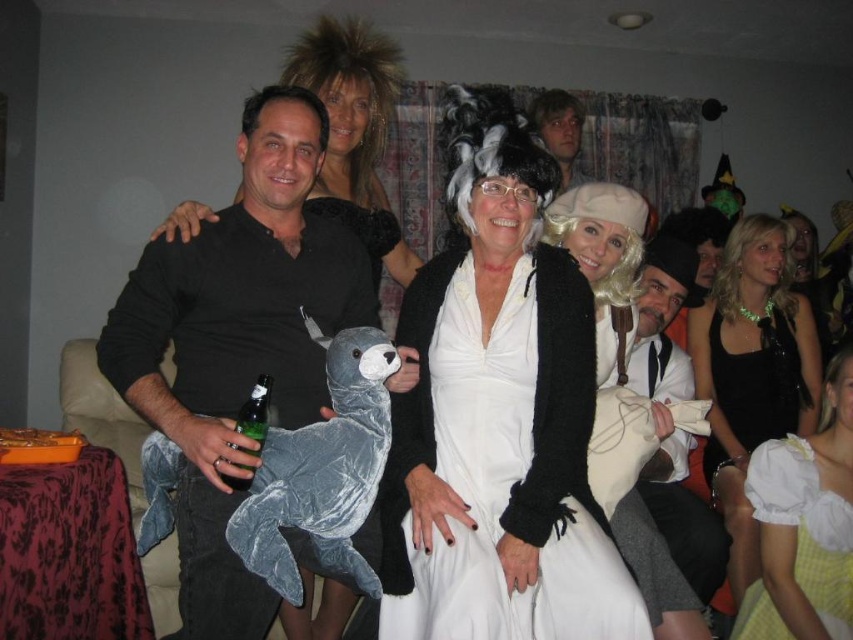
Question: Is yellow cotton dress at lower right closer to camera compared to black satin dress at center?

Choices:
 (A) no
 (B) yes

Answer: (B)

Question: Observing the image, what is the correct spatial positioning of white matte dress at center in reference to smooth brown hair at upper center?

Choices:
 (A) left
 (B) right

Answer: (A)

Question: Which is nearer to the velvet black shirt at center?

Choices:
 (A) white matte dress at center
 (B) yellow cotton dress at lower right
 (C) white matte wig at center

Answer: (A)

Question: Which point appears closest to the camera in this image?

Choices:
 (A) click(x=747, y=592)
 (B) click(x=321, y=163)
 (C) click(x=770, y=424)

Answer: (B)

Question: Which object appears farthest from the camera in this image?

Choices:
 (A) black satin dress at center
 (B) white matte wig at upper center

Answer: (A)

Question: Does white matte dress at center have a greater width compared to yellow cotton dress at lower right?

Choices:
 (A) yes
 (B) no

Answer: (A)